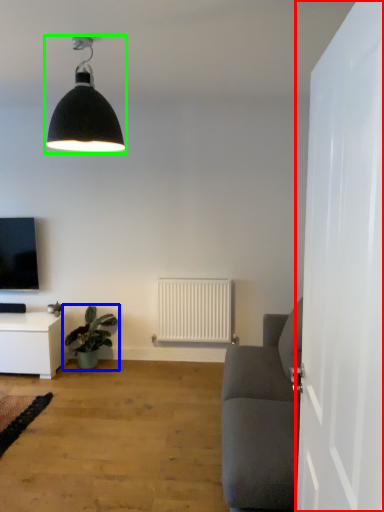
Question: Considering the real-world distances, which object is closest to door (highlighted by a red box)? houseplant (highlighted by a blue box) or lamp (highlighted by a green box).

Choices:
 (A) houseplant
 (B) lamp

Answer: (B)